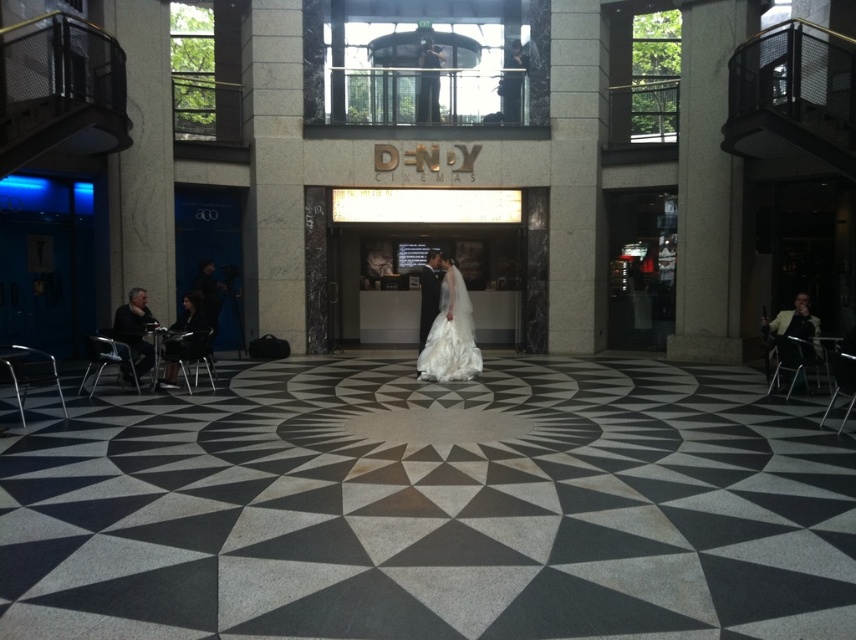
You are standing at the entrance of D_N_Y Cinemas and see the black textured carpet at center and the white satin dress at center. Which object is closer to you?

The black textured carpet at center is closer to you because it is in front of the white satin dress at center.

You are a photographer setting up a shoot in this space. You need to place a white satin dress at center and a light brown leather chair at right such that the dress is wider than the chair. Is this possible given their current positions?

The white satin dress at center might be wider than light brown leather chair at right, so yes, it is possible to place them in such a way that the dress is wider than the chair based on their current positions.